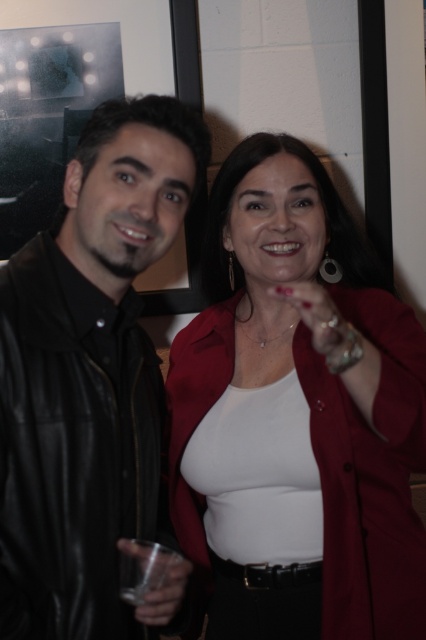
Question: Does matte red blazer at center come in front of clear plastic cup at lower left?

Choices:
 (A) no
 (B) yes

Answer: (B)

Question: Is matte red blazer at center to the left of black leather jacket at left from the viewer's perspective?

Choices:
 (A) no
 (B) yes

Answer: (A)

Question: Which of the following is the closest to the observer?

Choices:
 (A) (149, 609)
 (B) (394, 628)

Answer: (A)

Question: Considering the real-world distances, which object is closest to the matte red blazer at center?

Choices:
 (A) black leather jacket at left
 (B) clear plastic cup at lower left

Answer: (A)

Question: Which object is positioned farthest from the matte red blazer at center?

Choices:
 (A) clear plastic cup at lower left
 (B) black leather jacket at left

Answer: (A)

Question: Is matte red blazer at center positioned in front of clear plastic cup at lower left?

Choices:
 (A) no
 (B) yes

Answer: (B)